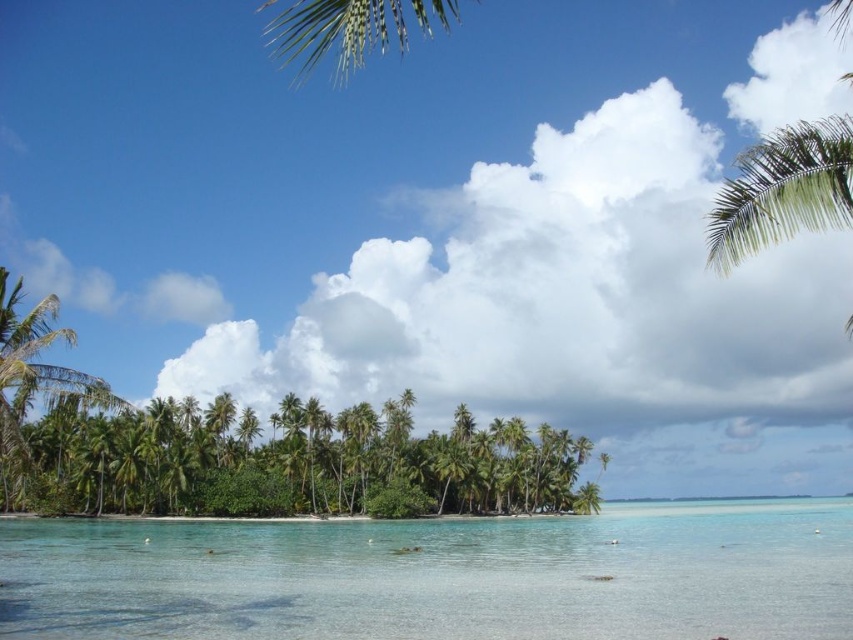
You are standing at the edge of the water in the tropical landscape scene. If you want to reach the clear water at center, in which direction should you walk from your current position?

The clear water at center is located at coordinates point (438, 577), so you should walk towards the center of the image to reach it.

From the picture: You are standing on the shore of the tropical landscape and want to take a photo of both the clear water at center and the green leafy palm tree at upper right. Which object will appear taller in your photo?

The green leafy palm tree at upper right will appear taller in the photo because it has a greater height than the clear water at center according to the description.

You are a swimmer who wants to swim from the shore to the green leafy palm tree at upper right. The clear water at center is where you can swim freely. Can you reach the palm tree without leaving the water? Explain your reasoning based on the distance between them.

The clear water at center and the green leafy palm tree at upper right are 127.01 feet apart. Since the palm tree is on land, you cannot swim to it as the distance is across water but the tree is on the shore or land, so you would have to exit the water to reach it.